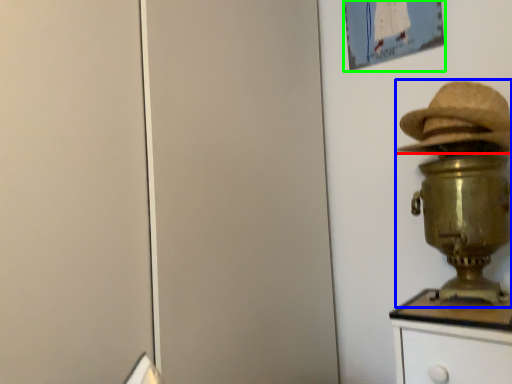
Question: Which object is positioned closest to hat (highlighted by a red box)? Select from table lamp (highlighted by a blue box) and picture frame (highlighted by a green box).

Choices:
 (A) table lamp
 (B) picture frame

Answer: (A)